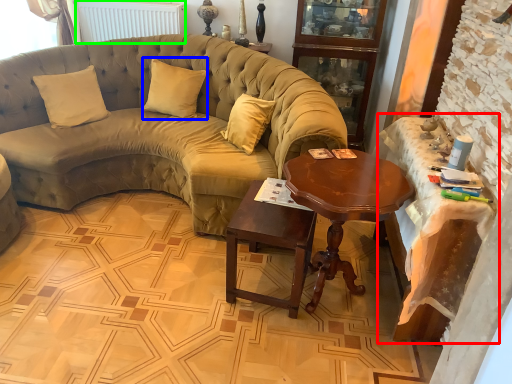
Question: Which object is positioned farthest from table (highlighted by a red box)? Select from pillow (highlighted by a blue box) and radiator (highlighted by a green box).

Choices:
 (A) pillow
 (B) radiator

Answer: (B)